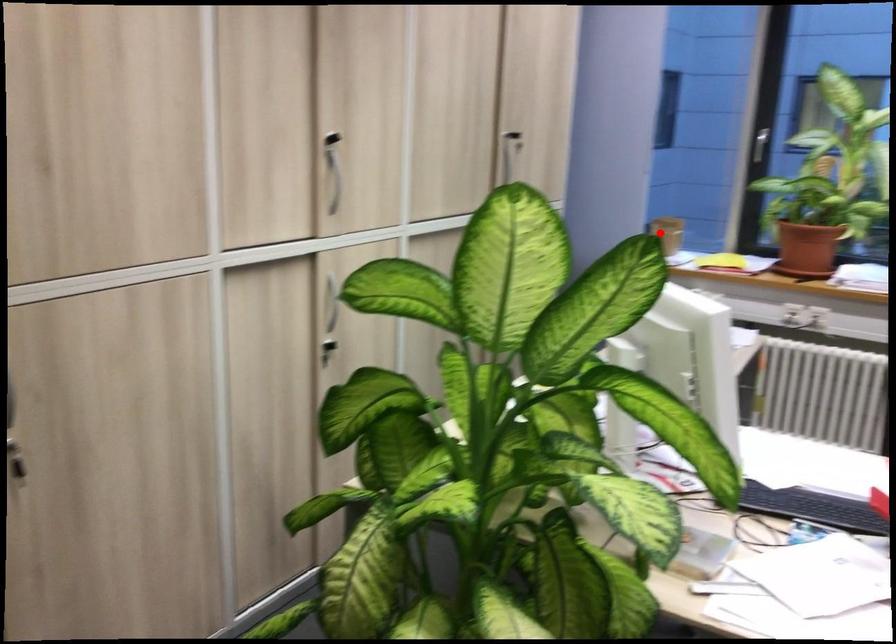
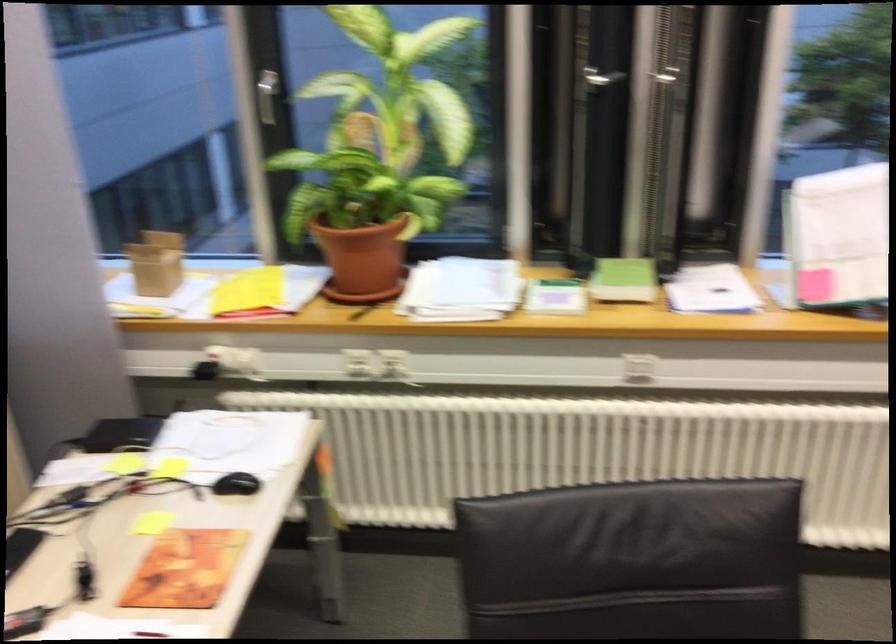
The point at the highlighted location is marked in the first image. Where is the corresponding point in the second image?

(156, 263)